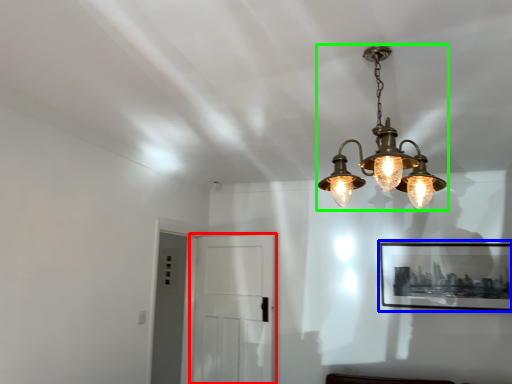
Question: Which object is the closest to the glass door (highlighted by a red box)? Choose among these: picture frame (highlighted by a blue box) or lamp (highlighted by a green box).

Choices:
 (A) picture frame
 (B) lamp

Answer: (A)